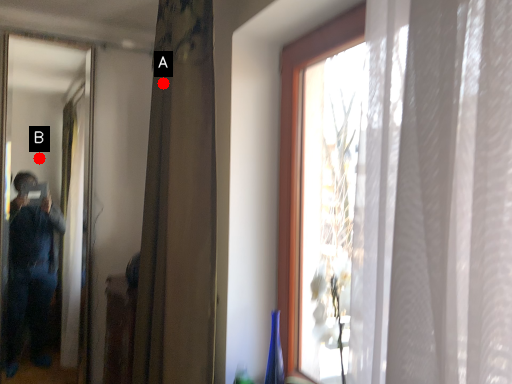
Question: Two points are circled on the image, labeled by A and B beside each circle. Which point is closer to the camera taking this photo?

Choices:
 (A) A is closer
 (B) B is closer

Answer: (A)